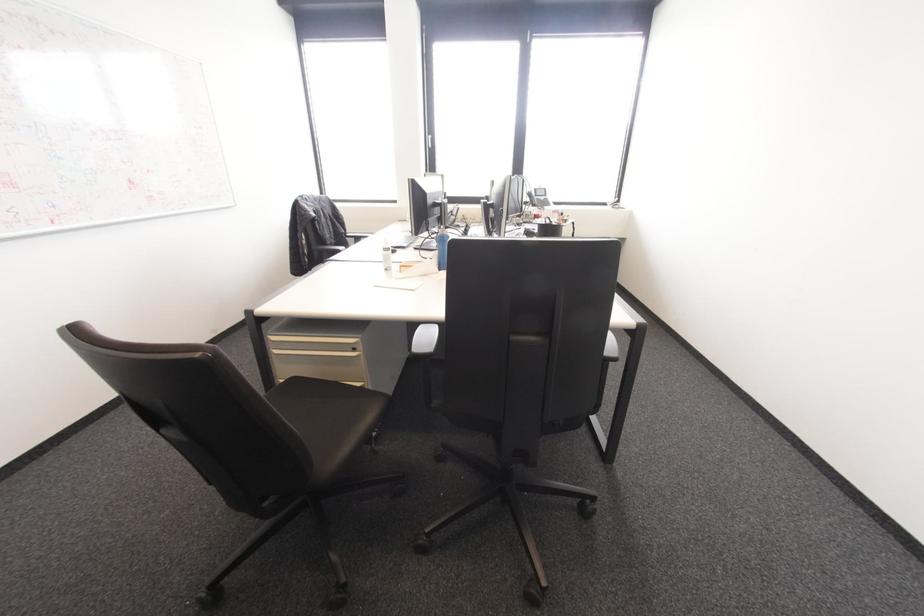
The height and width of the screenshot is (616, 924). I want to click on cabinet drawer handle, so click(x=321, y=346).